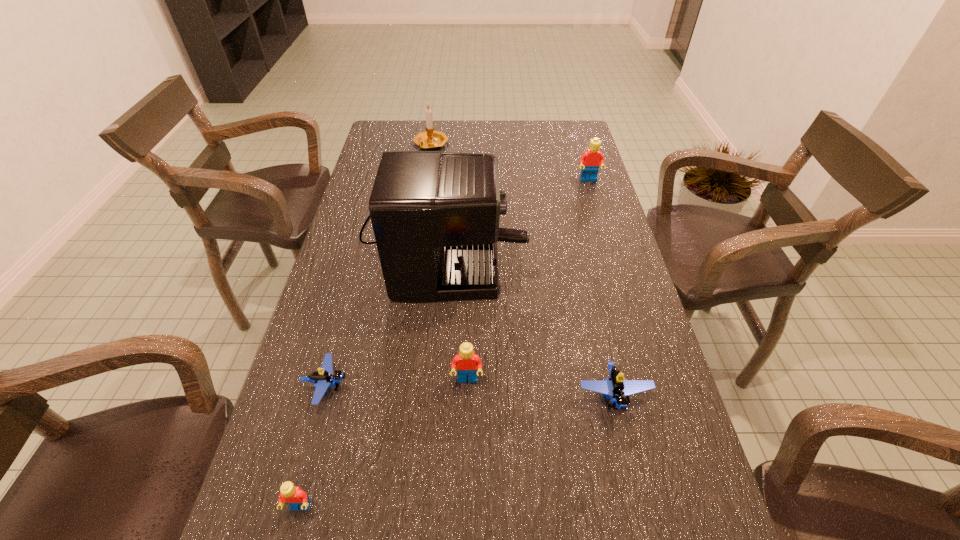
The image size is (960, 540). In order to click on coffee maker present at the left edge in this screenshot , I will do `click(435, 215)`.

The image size is (960, 540). Identify the location of candle holder that is at the left edge. (430, 139).

The height and width of the screenshot is (540, 960). What are the coordinates of `object located in the far left corner section of the desktop` in the screenshot? It's located at (430, 139).

In the image, there is a desktop. What are the coordinates of `vacant region at the far edge` in the screenshot? It's located at (535, 132).

What are the coordinates of `free space at the left edge` in the screenshot? It's located at (324, 451).

Locate an element on the screen. vacant space at the right edge of the desktop is located at coordinates (567, 254).

You are a GUI agent. You are given a task and a screenshot of the screen. Output one action in this format:
    pyautogui.click(x=<x>, y=<y>)
    Task: Click on the vacant region at the far right corner
    
    Given the screenshot: What is the action you would take?
    pyautogui.click(x=559, y=127)

Where is `free space between the farthest Lego and the gold candle holder`? free space between the farthest Lego and the gold candle holder is located at coordinates (510, 163).

Locate an element on the screen. This screenshot has width=960, height=540. unoccupied position between the rightmost red Lego and the right blue Lego is located at coordinates (601, 288).

What are the coordinates of `free space that is in between the biggest red Lego and the candle holder` in the screenshot? It's located at (510, 163).